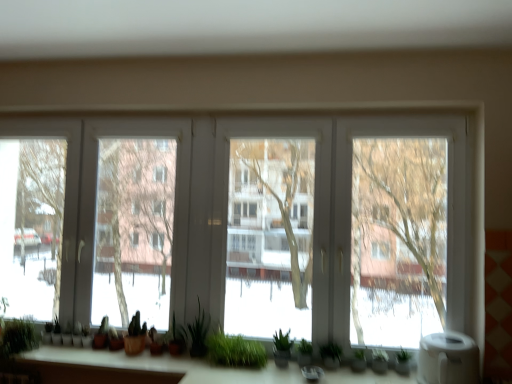
Question: Does green matte plant at center, the 3th plant when ordered from right to left, have a lesser width compared to white matte water heater at lower right?

Choices:
 (A) yes
 (B) no

Answer: (A)

Question: From a real-world perspective, is green matte plant at center, which is the 4th plant in left-to-right order, positioned over white matte water heater at lower right based on gravity?

Choices:
 (A) yes
 (B) no

Answer: (A)

Question: Considering the relative sizes of green matte plant at center, the 3th plant when ordered from right to left, and white matte water heater at lower right in the image provided, is green matte plant at center, the 3th plant when ordered from right to left, wider than white matte water heater at lower right?

Choices:
 (A) no
 (B) yes

Answer: (A)

Question: Is green matte plant at center, the 3th plant when ordered from right to left, to the left of white matte water heater at lower right from the viewer's perspective?

Choices:
 (A) yes
 (B) no

Answer: (A)

Question: Considering the relative sizes of green matte plant at center, which is the 4th plant in left-to-right order, and white matte water heater at lower right in the image provided, is green matte plant at center, which is the 4th plant in left-to-right order, bigger than white matte water heater at lower right?

Choices:
 (A) no
 (B) yes

Answer: (A)

Question: Is green matte plant at center, which is the 4th plant in left-to-right order, in front of white matte water heater at lower right?

Choices:
 (A) yes
 (B) no

Answer: (B)

Question: Is the position of green matte plant at lower center, the 5th plant positioned from the left, more distant than that of green grass at center?

Choices:
 (A) no
 (B) yes

Answer: (B)

Question: Are green matte plant at lower center, which is the second plant in right-to-left order, and green grass at center making contact?

Choices:
 (A) yes
 (B) no

Answer: (B)

Question: Is green matte plant at lower center, the 5th plant positioned from the left, closer to the viewer compared to green grass at center?

Choices:
 (A) yes
 (B) no

Answer: (B)

Question: Can you confirm if green matte plant at lower center, the 5th plant positioned from the left, is positioned to the left of green grass at center?

Choices:
 (A) yes
 (B) no

Answer: (B)

Question: Is green matte plant at lower center, the 5th plant positioned from the left, taller than green grass at center?

Choices:
 (A) yes
 (B) no

Answer: (B)

Question: Can you confirm if green matte plant at lower center, the 5th plant positioned from the left, is wider than green grass at center?

Choices:
 (A) yes
 (B) no

Answer: (B)

Question: Is white matte water heater at lower right to the right of green matte plant at center, the fourth plant in the right-to-left sequence, from the viewer's perspective?

Choices:
 (A) no
 (B) yes

Answer: (B)